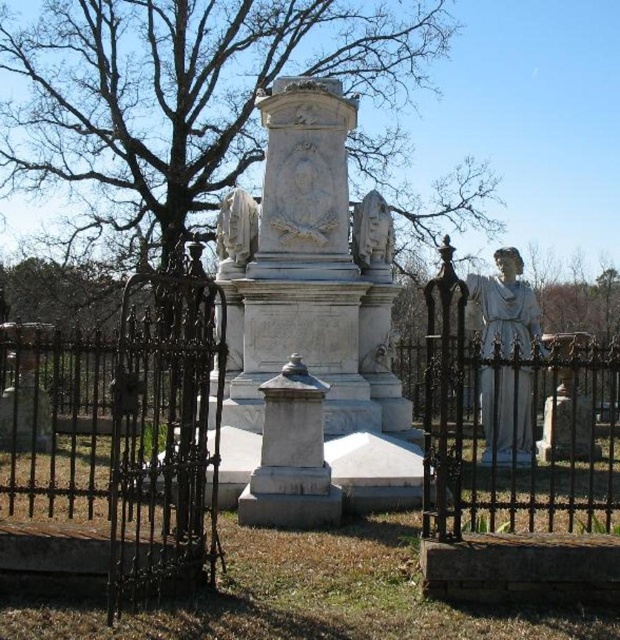
You are standing at the entrance of the cemetery and want to find the white marble monument at center. According to the coordinates provided, in which direction should you walk from your current position to reach it?

The white marble monument at center is located at coordinates point (311, 272). Since you are at the entrance, you should walk towards the center of the cemetery where the monument is situated based on its central position in the scene description.

You are a visitor at the cemetery and want to take a photo of both the white marble monument at center and the white marble statue at center. Since you have a wide angle lens, you can capture both in one shot. However, you want to ensure that the monument is clearly visible and not overshadowed by the statue. Based on their sizes, which object should you position closer to the camera to achieve this?

The white marble monument at center is larger than the white marble statue at center. To ensure the monument is clearly visible and not overshadowed, position the camera closer to the monument so its larger size remains prominent in the photo.

You are standing at the entrance of the cemetery and want to approach the black wrought iron fence at center. According to the coordinates provided, in which direction should you move from your current position?

The black wrought iron fence at center is located at point 0.723 on the x and 0.147 on the y coordinates. Since the entrance is typically at the edge, you should move towards the center of the image to reach it.